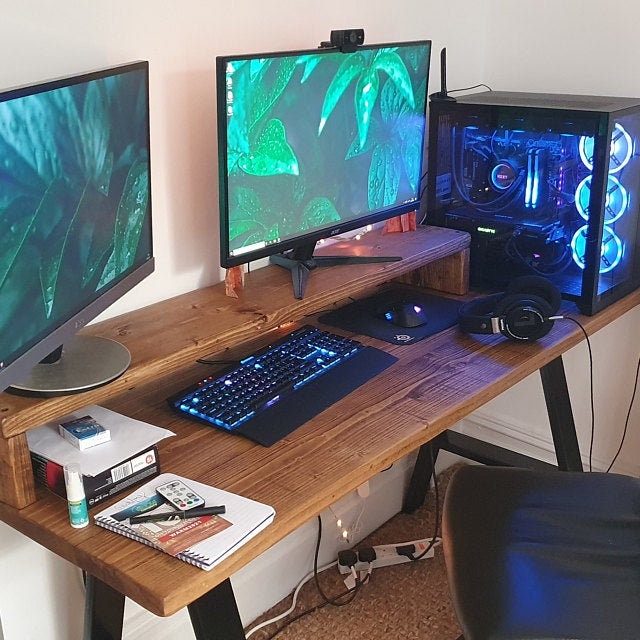
You are a GUI agent. You are given a task and a screenshot of the screen. Output one action in this format:
    pyautogui.click(x=<x>, y=<y>)
    Task: Click on the remote
    The image size is (640, 640).
    Given the screenshot: What is the action you would take?
    (x=178, y=495)